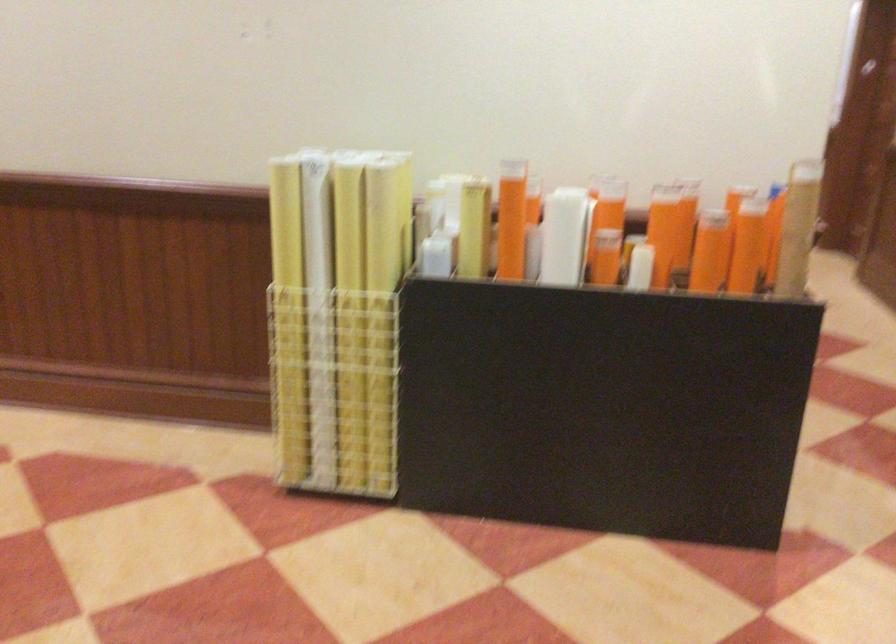
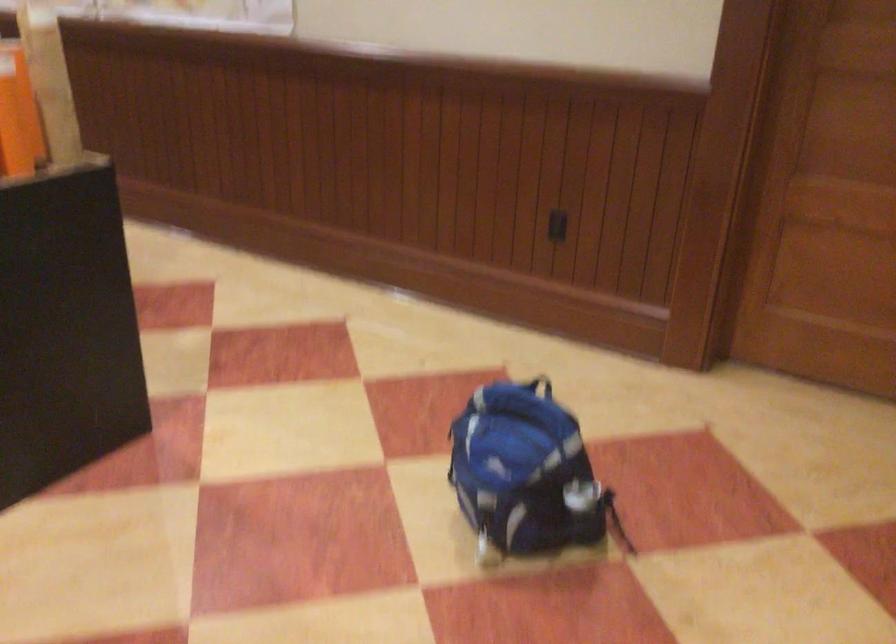
First-person continuous shooting, in which direction is the camera rotating?

The rotation direction of the camera is right-down.